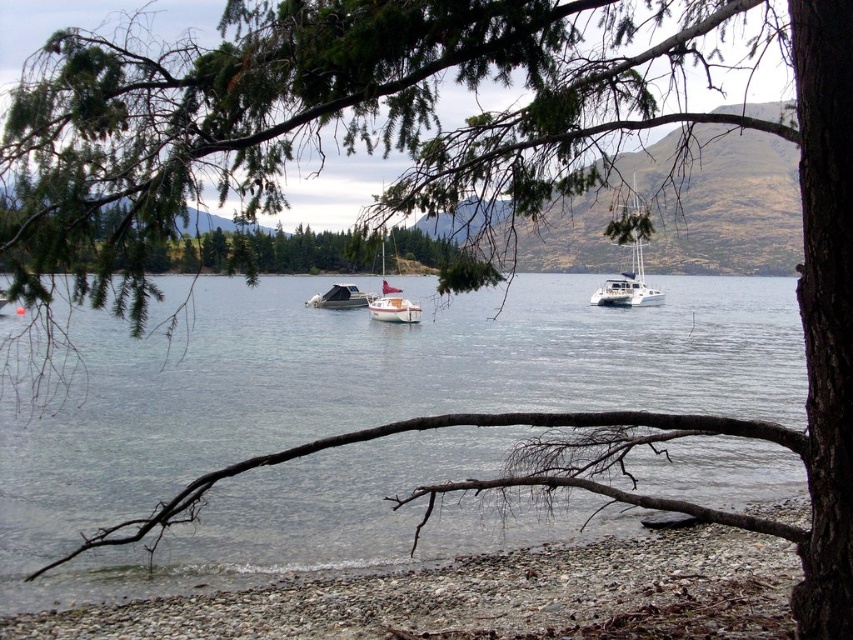
Which is behind, point (636, 208) or point (329, 288)?

The point (329, 288) is behind.

Identify the location of white glossy catamaran at center. (628, 284).

Where is `white glossy catamaran at center`? white glossy catamaran at center is located at coordinates coord(628,284).

Is smooth pebbles at lower left above white glossy sailboat at center?

Incorrect, smooth pebbles at lower left is not positioned above white glossy sailboat at center.

Does smooth pebbles at lower left appear on the right side of white glossy sailboat at center?

No, smooth pebbles at lower left is not to the right of white glossy sailboat at center.

Locate an element on the screen. The image size is (853, 640). smooth pebbles at lower left is located at coordinates (485, 596).

Consider the image. Can you confirm if clear water at center is wider than white glossy sailboat at center?

Correct, the width of clear water at center exceeds that of white glossy sailboat at center.

Who is positioned more to the left, clear water at center or white glossy sailboat at center?

white glossy sailboat at center

What do you see at coordinates (361, 388) in the screenshot? I see `clear water at center` at bounding box center [361, 388].

You are a GUI agent. You are given a task and a screenshot of the screen. Output one action in this format:
    pyautogui.click(x=<x>, y=<y>)
    Task: Click on the clear water at center
    Image resolution: width=853 pixels, height=640 pixels.
    Given the screenshot: What is the action you would take?
    pyautogui.click(x=361, y=388)